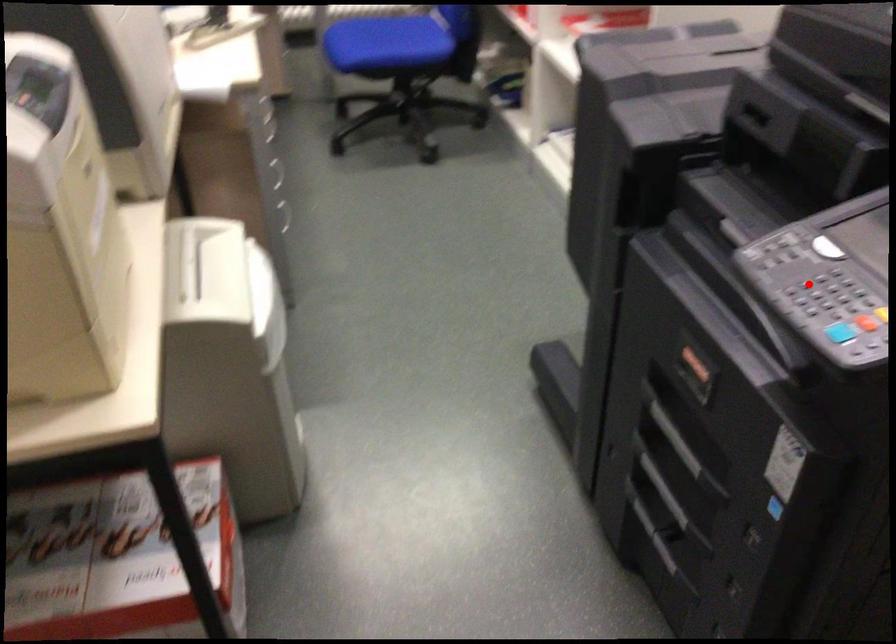
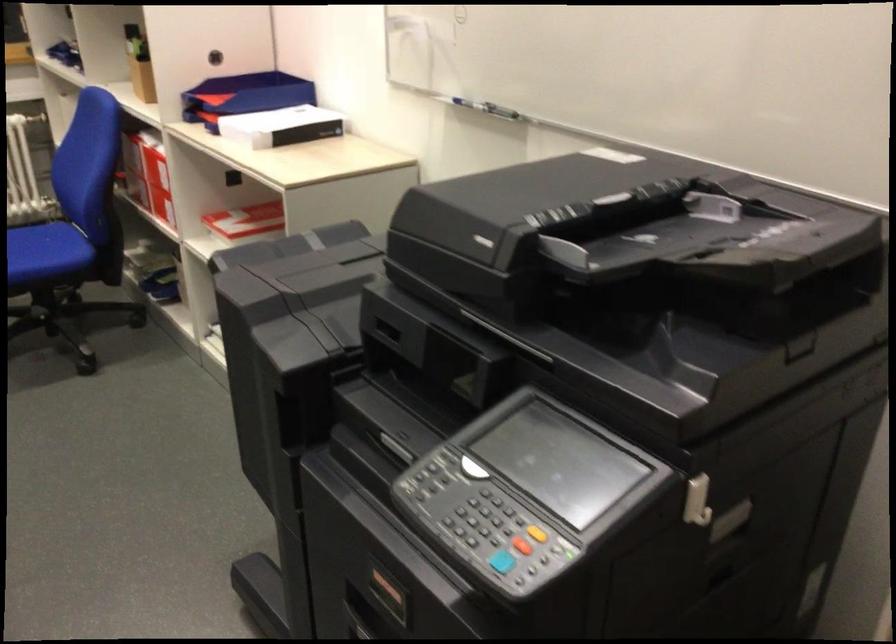
Where in the second image is the point corresponding to the highlighted location from the first image?

(470, 514)